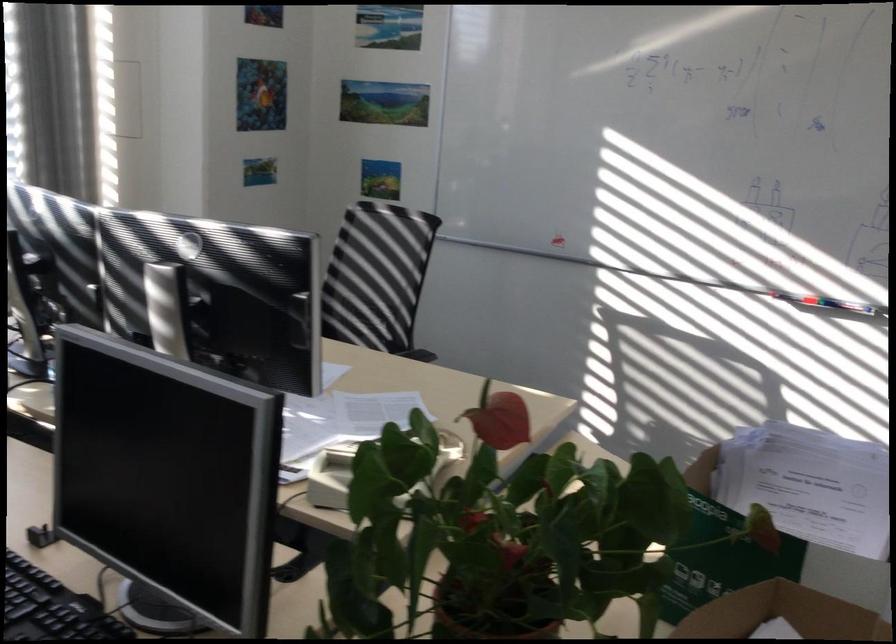
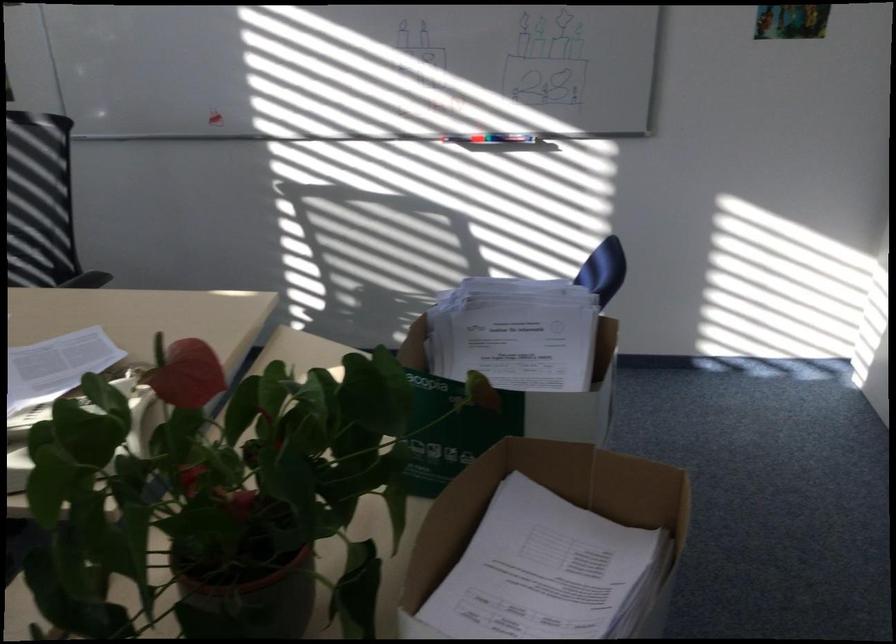
In the second image, find the point that corresponds to (719,565) in the first image.

(451, 431)